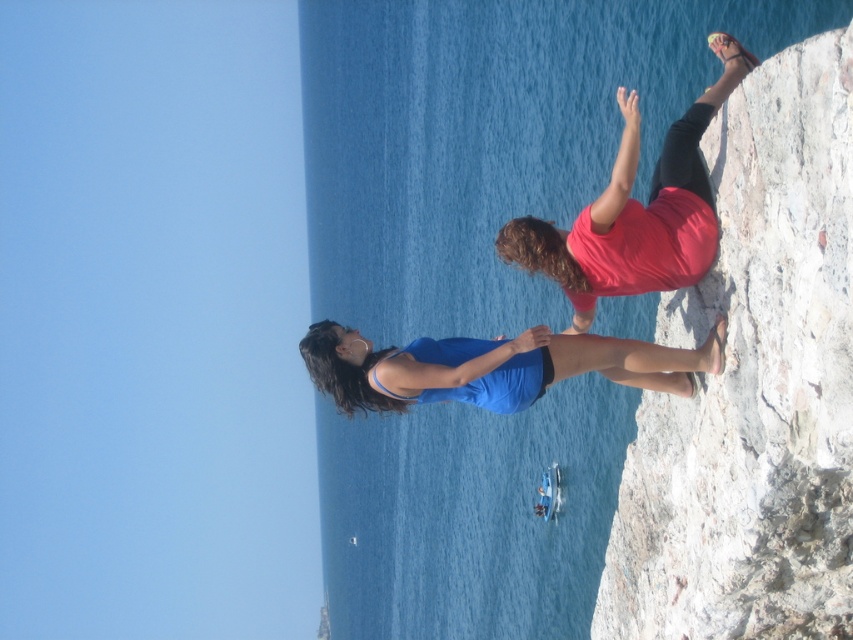
Who is more distant from viewer, (769,272) or (358,339)?

Point (358,339)

Is smooth gray rock at right wider than blue fabric at center?

In fact, smooth gray rock at right might be narrower than blue fabric at center.

Between point (643, 401) and point (399, 412), which one is positioned in front?

Point (399, 412) is in front.

In order to click on smooth gray rock at right in this screenshot , I will do `click(753, 387)`.

This screenshot has height=640, width=853. What do you see at coordinates (753, 387) in the screenshot?
I see `smooth gray rock at right` at bounding box center [753, 387].

Between point (776, 618) and point (712, 42), which one is positioned behind?

The point (712, 42) is behind.

Is point (804, 456) farther from viewer compared to point (631, 214)?

No, (804, 456) is closer to viewer.

Locate an element on the screen. This screenshot has height=640, width=853. smooth gray rock at right is located at coordinates (753, 387).

Between matte red shirt at upper right and blue fabric at center, which one is positioned lower?

blue fabric at center is below.

Is matte red shirt at upper right to the right of blue fabric at center from the viewer's perspective?

Yes, matte red shirt at upper right is to the right of blue fabric at center.

Which is behind, point (598, 257) or point (352, 337)?

Positioned behind is point (352, 337).

Identify the location of matte red shirt at upper right. The image size is (853, 640). (637, 211).